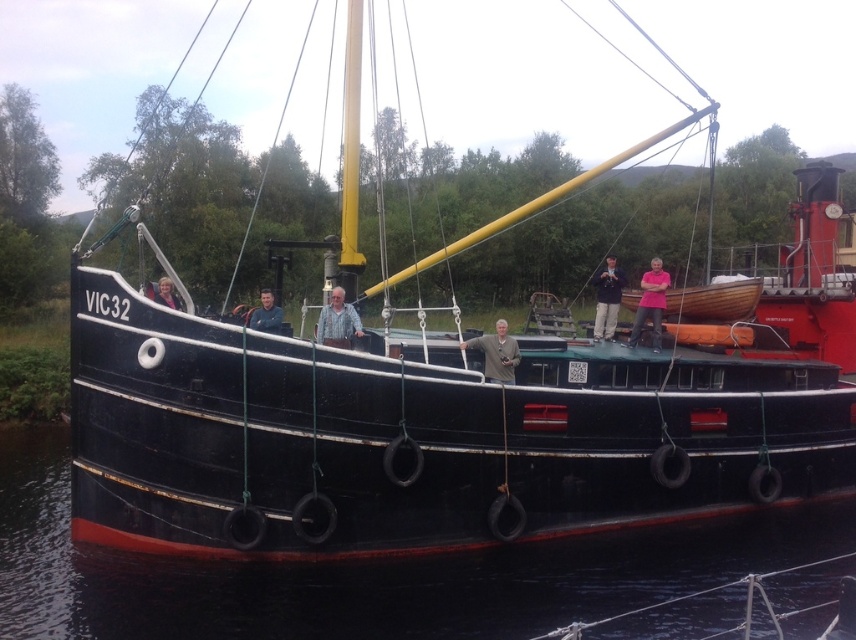
You are a photographer trying to capture both the gray fabric jacket at center and the matte black shirt at center in a single frame. Given that your camera has a maximum focus range of 10 meters, will you be able to include both subjects in sharp focus?

The distance between the gray fabric jacket at center and the matte black shirt at center is 10.16 meters. Since the camera can only focus up to 10 meters, the subjects are slightly out of the camera range. You might need to adjust your position or use a different camera with a longer focus range to capture both in sharp focus.

You are a photographer trying to capture a photo of the pink fabric at center and the gray fabric jacket at center on the boat VIC32. From your current position, which fabric is more to the right?

The pink fabric at center is more to the right because it is positioned on the right side of the gray fabric jacket at center.

You are a photographer trying to capture a group photo of the people on the boat. Since you want to ensure everyone is visible, you need to know which clothing item takes up more space. Which one is larger between the gray fabric jacket at center and the matte black shirt at center?

The matte black shirt at center is larger since the gray fabric jacket at center occupies less space than it.